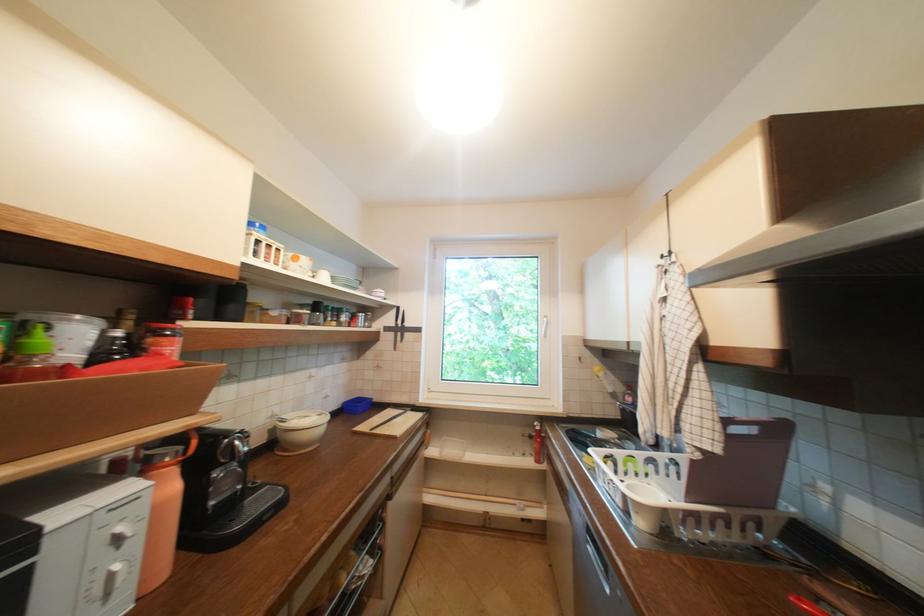
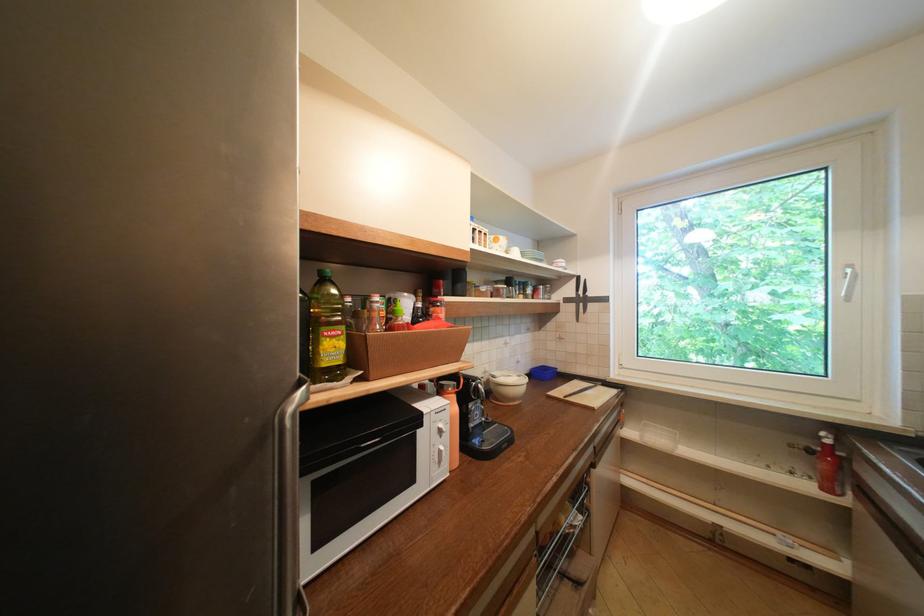
Where in the second image is the point corresponding to (542,427) from the first image?

(829, 439)